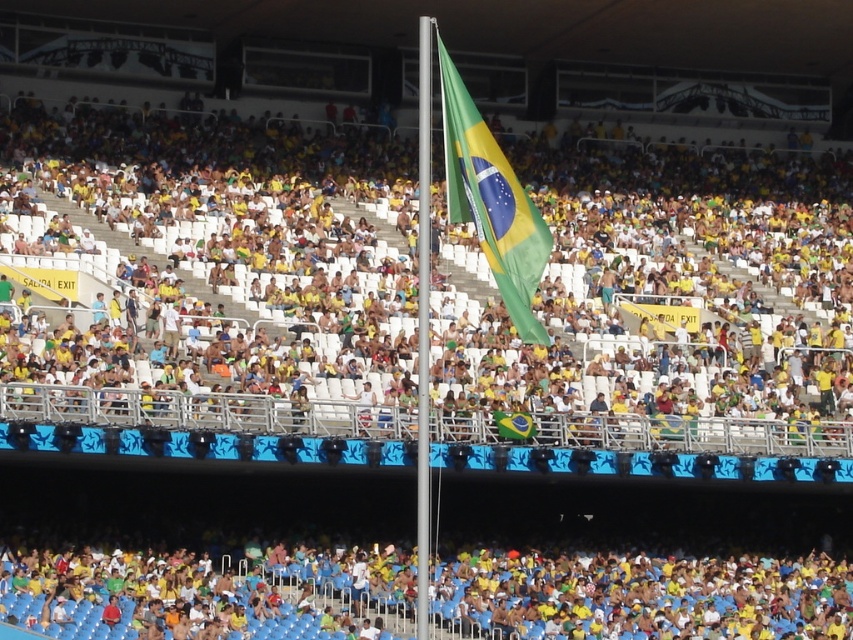
You are a photographer at the stadium and want to capture both the yellow fabric flag at center and the green fabric flag at center in a single shot. Based on their positions, which flag should you focus on first to ensure both are in frame?

The yellow fabric flag at center is to the right of green fabric flag at center, so you should focus on the green fabric flag at center first to ensure both are in frame.

You are a photographer trying to capture the Brazilian flag in the stadium. You notice the yellow fabric crowd at center and the yellow fabric flag at center. Which object is blocking your view of the other?

The yellow fabric crowd at center is blocking the view of the yellow fabric flag at center because the flag is behind the crowd.

You are a drone operator tasked with capturing aerial footage of the stadium. The drone is currently positioned above the yellow fabric flag at center. You need to move it to the yellow fabric crowd at center. Is the distance between them sufficient for the drone to navigate safely, considering the drone requires a minimum of 5 meters of clearance between obstacles?

The distance between the yellow fabric crowd at center and the yellow fabric flag at center is 7.73 meters, which is greater than the required 5 meters clearance. Therefore, the drone can navigate safely between them.